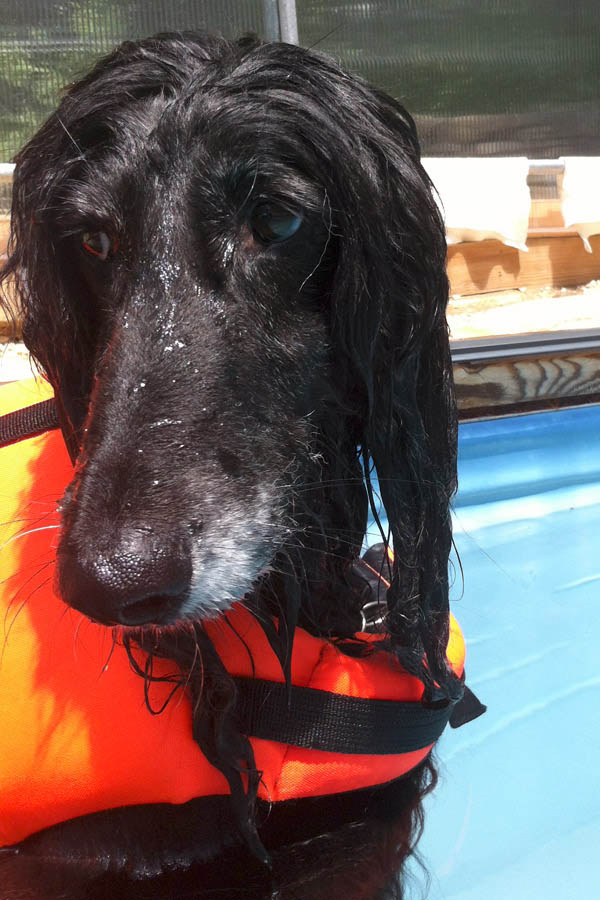
Where is `window`? The width and height of the screenshot is (600, 900). window is located at coordinates (434, 52).